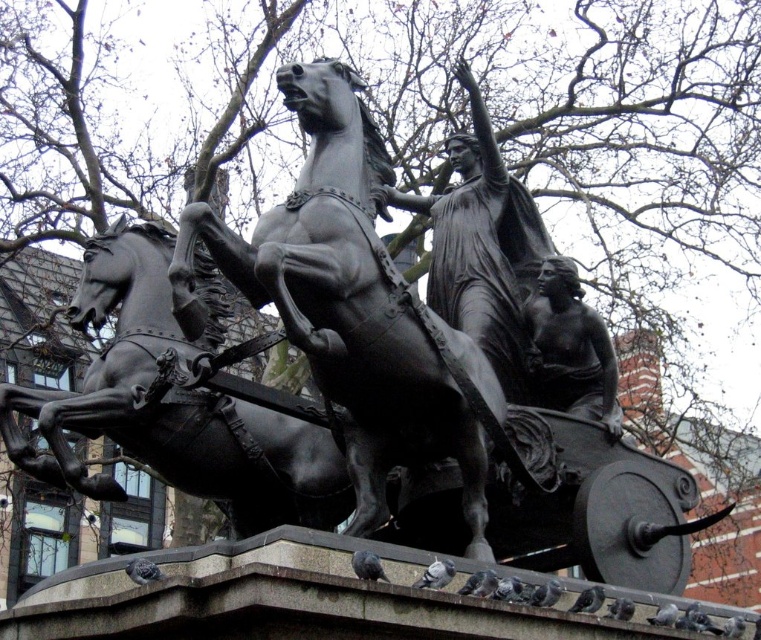
You are a photographer trying to capture the entire bronze sculpture and its pedestal. You notice the polished bronze horse at center and the bronze statue at center. Which object should you focus on first if you want to ensure both are in frame?

The polished bronze horse at center is positioned on the left side of bronze statue at center. To capture both in frame, focus on the bronze statue at center first as it is the central subject, then adjust to include the horse on its left side.